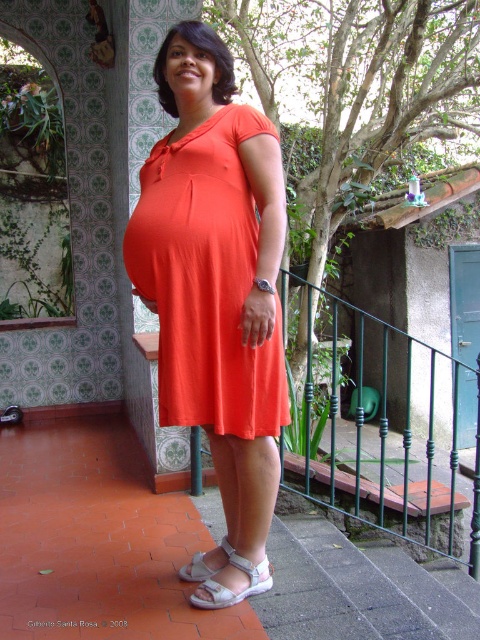
Is point (416, 516) behind point (203, 554)?

Yes, it is behind point (203, 554).

What do you see at coordinates (382, 428) in the screenshot?
I see `green metal balustrade at center` at bounding box center [382, 428].

This screenshot has height=640, width=480. Describe the element at coordinates (382, 428) in the screenshot. I see `green metal balustrade at center` at that location.

The width and height of the screenshot is (480, 640). Find the location of `green metal balustrade at center`. green metal balustrade at center is located at coordinates (382, 428).

Does orange matte dress at center have a greater width compared to white fabric sandal at lower center?

Yes.

Does orange matte dress at center have a larger size compared to white fabric sandal at lower center?

Indeed, orange matte dress at center has a larger size compared to white fabric sandal at lower center.

Between point (192, 268) and point (196, 572), which one is positioned in front?

Point (192, 268) is in front.

Image resolution: width=480 pixels, height=640 pixels. Find the location of `orange matte dress at center`. orange matte dress at center is located at coordinates click(205, 280).

Is orange matte dress at center to the right of green metal balustrade at center from the viewer's perspective?

No, orange matte dress at center is not to the right of green metal balustrade at center.

Who is shorter, orange matte dress at center or green metal balustrade at center?

Standing shorter between the two is orange matte dress at center.

The image size is (480, 640). I want to click on orange matte dress at center, so click(x=205, y=280).